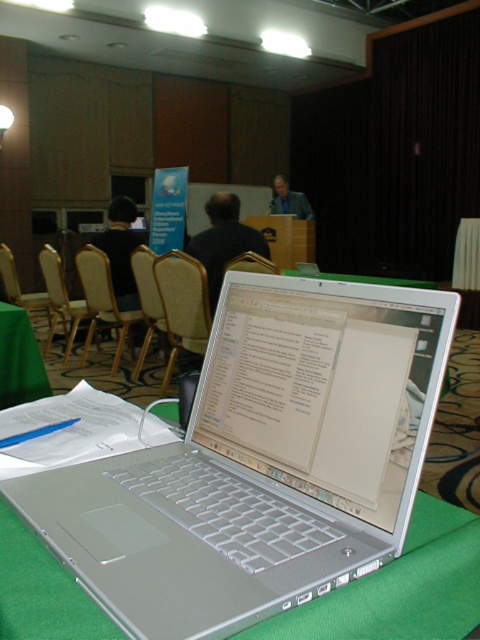
Question: Which point appears farthest from the camera in this image?

Choices:
 (A) (154, 307)
 (B) (91, 280)

Answer: (B)

Question: Can you confirm if beige fabric chair at center is smaller than green fabric tablecloth at lower left?

Choices:
 (A) no
 (B) yes

Answer: (A)

Question: Observing the image, what is the correct spatial positioning of light beige leather chair at center in reference to light beige fabric chair at left?

Choices:
 (A) left
 (B) right

Answer: (B)

Question: Which object is closer to the camera taking this photo?

Choices:
 (A) light beige fabric chair at left
 (B) beige fabric chair at center
 (C) green fabric tablecloth at lower left
 (D) light brown wood chair at left

Answer: (C)

Question: Which point is farther to the camera?

Choices:
 (A) (12, 340)
 (B) (1, 269)

Answer: (B)

Question: Is green fabric tablecloth at lower left smaller than light brown wood chair at center?

Choices:
 (A) yes
 (B) no

Answer: (A)